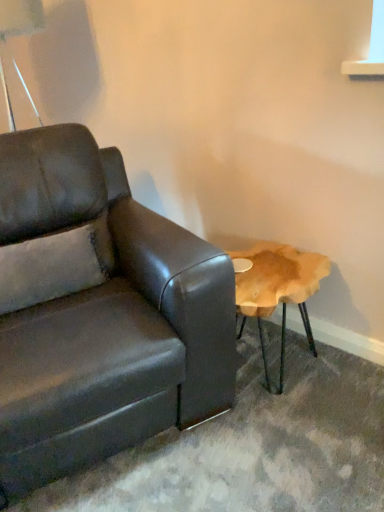
Describe the element at coordinates (20, 18) in the screenshot. I see `metallic silver table lamp at upper left` at that location.

I want to click on metallic silver table lamp at upper left, so click(x=20, y=18).

Describe the element at coordinates (99, 311) in the screenshot. I see `matte leather couch at left` at that location.

Measure the distance between point (x=182, y=384) and camera.

4.41 feet.

Identify the location of matte leather couch at left. (99, 311).

Identify the location of metallic silver table lamp at upper left. This screenshot has width=384, height=512. (20, 18).

Consider the image. Does matte leather couch at left appear on the right side of metallic silver table lamp at upper left?

Yes, matte leather couch at left is to the right of metallic silver table lamp at upper left.

Which object is closer to the camera taking this photo, matte leather couch at left or metallic silver table lamp at upper left?

matte leather couch at left.

Which is nearer, [97,449] or [35,106]?

Point [97,449].

From the image's perspective, which is above, matte leather couch at left or metallic silver table lamp at upper left?

metallic silver table lamp at upper left is shown above in the image.

From a real-world perspective, which is physically below, matte leather couch at left or metallic silver table lamp at upper left?

matte leather couch at left.

Can you confirm if matte leather couch at left is wider than metallic silver table lamp at upper left?

Yes.

Between matte leather couch at left and metallic silver table lamp at upper left, which one has more height?

matte leather couch at left.

Based on their sizes in the image, would you say matte leather couch at left is bigger or smaller than metallic silver table lamp at upper left?

Considering their sizes, matte leather couch at left takes up more space than metallic silver table lamp at upper left.

Is matte leather couch at left located outside metallic silver table lamp at upper left?

That's correct, matte leather couch at left is outside of metallic silver table lamp at upper left.

Is there a large distance between matte leather couch at left and metallic silver table lamp at upper left?

Indeed, matte leather couch at left is not near metallic silver table lamp at upper left.

Could you tell me if matte leather couch at left is facing metallic silver table lamp at upper left?

No.

Measure the distance between matte leather couch at left and metallic silver table lamp at upper left.

They are 5.47 feet apart.

Where is `studio couch in front of the metallic silver table lamp at upper left`? The image size is (384, 512). studio couch in front of the metallic silver table lamp at upper left is located at coordinates (99, 311).

Does metallic silver table lamp at upper left appear on the left side of matte leather couch at left?

Yes, metallic silver table lamp at upper left is to the left of matte leather couch at left.

Considering the relative positions of metallic silver table lamp at upper left and matte leather couch at left in the image provided, is metallic silver table lamp at upper left in front of matte leather couch at left?

No.

Is point (25, 8) positioned in front of point (5, 472)?

No, (25, 8) is behind (5, 472).

From the image's perspective, would you say metallic silver table lamp at upper left is positioned over matte leather couch at left?

Yes, from the image's perspective, metallic silver table lamp at upper left is over matte leather couch at left.

From a real-world perspective, who is located higher, metallic silver table lamp at upper left or matte leather couch at left?

metallic silver table lamp at upper left.

From the picture: Looking at their sizes, would you say metallic silver table lamp at upper left is wider or thinner than matte leather couch at left?

Clearly, metallic silver table lamp at upper left has less width compared to matte leather couch at left.

Considering the relative sizes of metallic silver table lamp at upper left and matte leather couch at left in the image provided, is metallic silver table lamp at upper left taller than matte leather couch at left?

Incorrect, the height of metallic silver table lamp at upper left is not larger of that of matte leather couch at left.

Who is bigger, metallic silver table lamp at upper left or matte leather couch at left?

matte leather couch at left.

Consider the image. Is metallic silver table lamp at upper left inside the boundaries of matte leather couch at left, or outside?

metallic silver table lamp at upper left cannot be found inside matte leather couch at left.

Is metallic silver table lamp at upper left not near matte leather couch at left?

metallic silver table lamp at upper left is far away from matte leather couch at left.

Looking at this image, is metallic silver table lamp at upper left facing towards matte leather couch at left?

No, metallic silver table lamp at upper left is not aimed at matte leather couch at left.

Can you tell me how much metallic silver table lamp at upper left and matte leather couch at left differ in facing direction?

They differ by 13.7 degrees in their facing directions.

In order to click on table lamp that is above the matte leather couch at left (from the image's perspective) in this screenshot , I will do `click(20, 18)`.

This screenshot has width=384, height=512. In order to click on studio couch located on the right of metallic silver table lamp at upper left in this screenshot , I will do `click(99, 311)`.

Locate an element on the screen. table lamp to the left of matte leather couch at left is located at coordinates (20, 18).